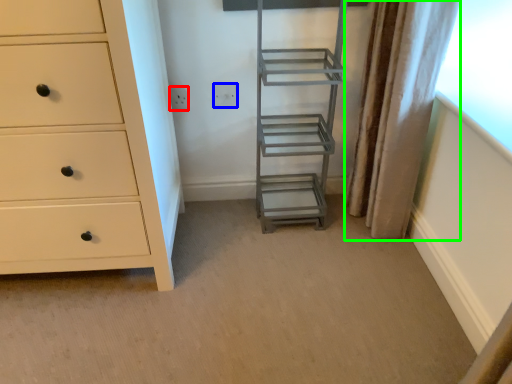
Question: Which object is the farthest from electric outlet (highlighted by a red box)? Choose among these: electric outlet (highlighted by a blue box) or curtain (highlighted by a green box).

Choices:
 (A) electric outlet
 (B) curtain

Answer: (B)